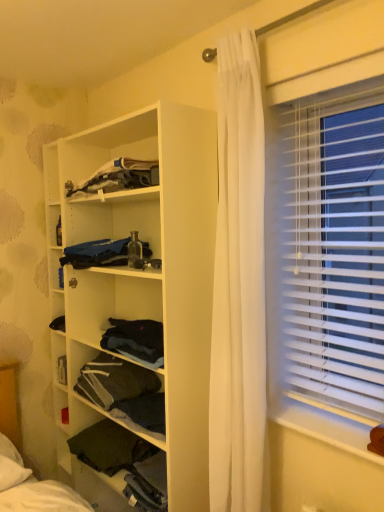
Where is `vacant space situated above white plastic window sill at lower right (from a real-world perspective)`? Image resolution: width=384 pixels, height=512 pixels. vacant space situated above white plastic window sill at lower right (from a real-world perspective) is located at coordinates (318, 418).